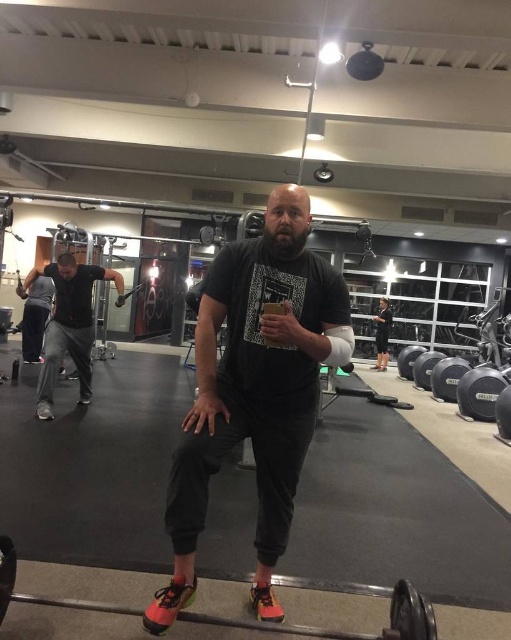
Is black rubber barbell at center below black matte t-shirt at center?

Correct, black rubber barbell at center is located below black matte t-shirt at center.

Between black rubber barbell at center and black matte t-shirt at center, which one appears on the left side from the viewer's perspective?

From the viewer's perspective, black matte t-shirt at center appears more on the left side.

Which is behind, point (66, 600) or point (85, 272)?

The point (85, 272) is behind.

In order to click on black rubber barbell at center in this screenshot , I will do `click(347, 632)`.

Which is above, matte black t-shirt at center or black matte t-shirt at center?

black matte t-shirt at center

In order to click on matte black t-shirt at center in this screenshot , I will do `click(254, 388)`.

Where is `matte black t-shirt at center`? matte black t-shirt at center is located at coordinates (254, 388).

Between point (283, 324) and point (14, 560), which one is positioned in front?

Point (283, 324)

Measure the distance between matte black t-shirt at center and camera.

matte black t-shirt at center and camera are 1.68 meters apart.

At what (x,y) coordinates should I click in order to perform the action: click on matte black t-shirt at center. Please return your answer as a coordinate pair (x, y). Looking at the image, I should click on pyautogui.click(x=254, y=388).